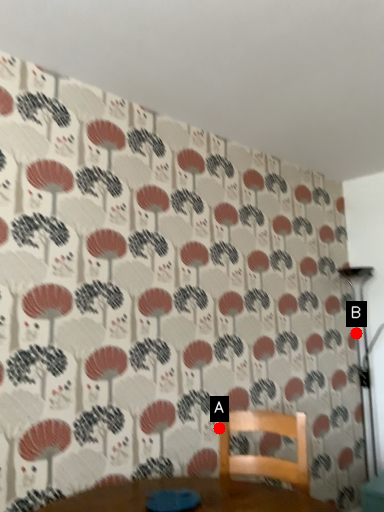
Question: Two points are circled on the image, labeled by A and B beside each circle. Which point is closer to the camera?

Choices:
 (A) A is closer
 (B) B is closer

Answer: (A)